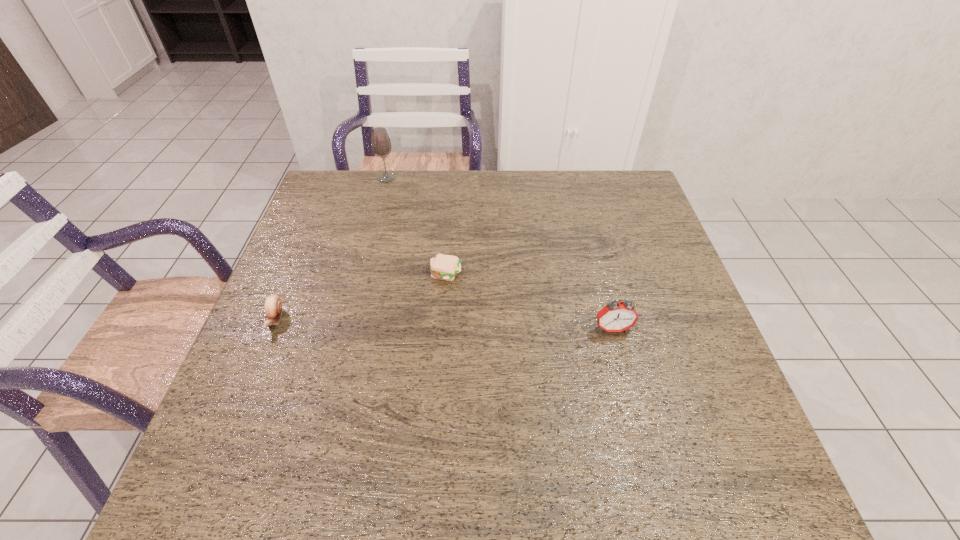
At what (x,y) coordinates should I click in order to perform the action: click on vacant region between the third nearest object and the alarm clock. Please return your answer as a coordinate pair (x, y). The image size is (960, 540). Looking at the image, I should click on (529, 301).

Identify which object is the third nearest to the second tallest object. Please provide its 2D coordinates. Your answer should be formatted as a tuple, i.e. [(x, y)], where the tuple contains the x and y coordinates of a point satisfying the conditions above.

[(381, 145)]

Where is `the second closest object to the alarm clock`? the second closest object to the alarm clock is located at coordinates (273, 306).